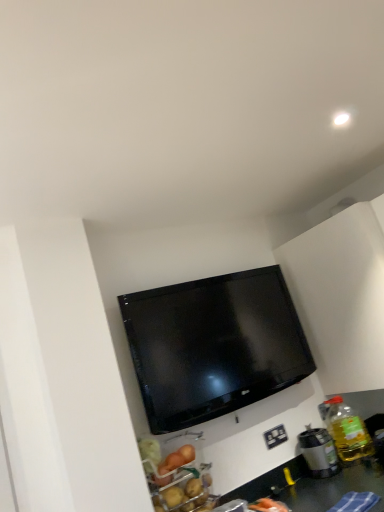
Question: Visually, is metallic silver coffee maker at lower right positioned to the left or to the right of white plastic electrical outlet at lower right?

Choices:
 (A) left
 (B) right

Answer: (B)

Question: From a real-world perspective, is metallic silver coffee maker at lower right physically located above or below white plastic electrical outlet at lower right?

Choices:
 (A) below
 (B) above

Answer: (A)

Question: Considering the real-world distances, which object is farthest from the metallic silver coffee maker at lower right?

Choices:
 (A) translucent yellow bottle at right
 (B) white plastic electrical outlet at lower right

Answer: (B)

Question: Which object is positioned closest to the white plastic electrical outlet at lower right?

Choices:
 (A) translucent yellow bottle at right
 (B) metallic silver coffee maker at lower right

Answer: (B)